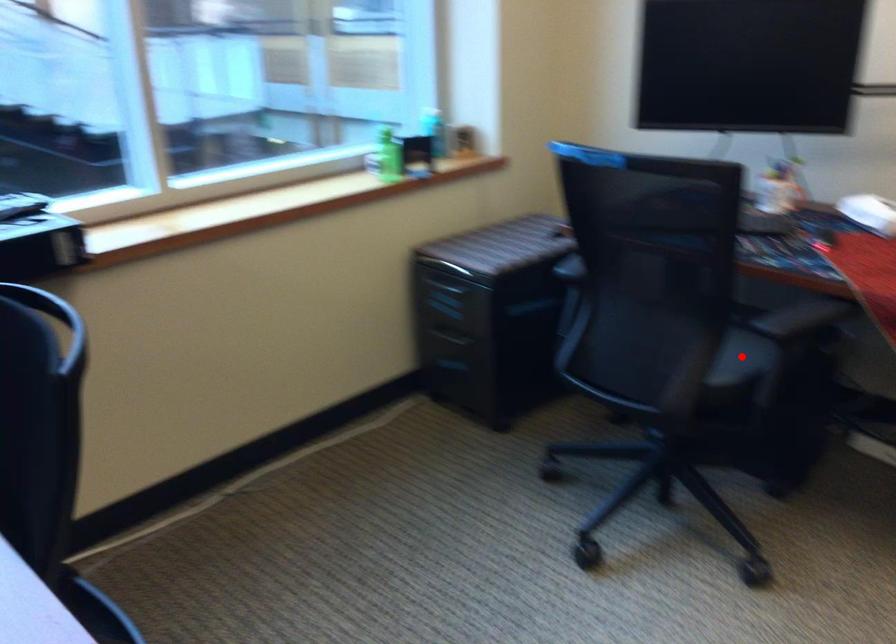
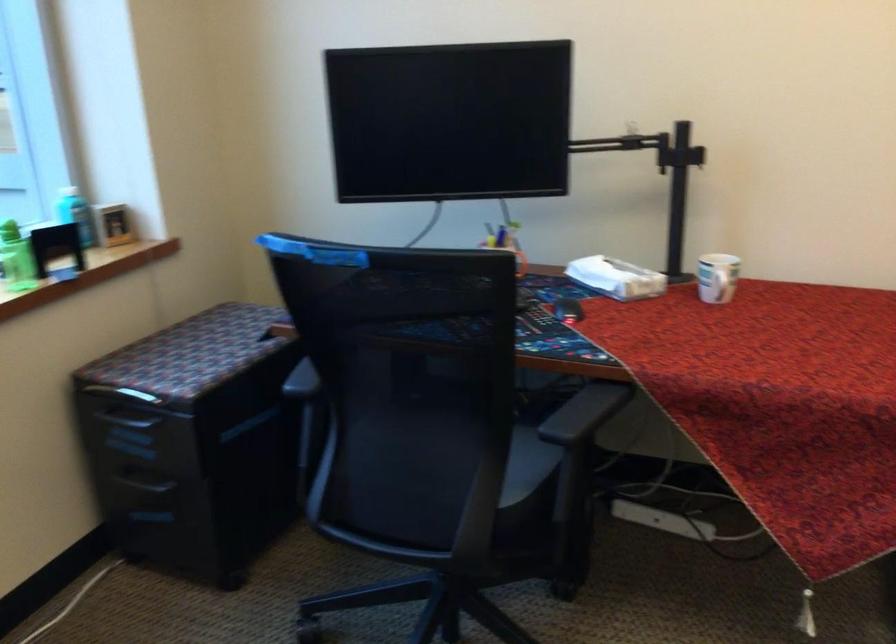
Question: I am providing you with two images of the same scene from different viewpoints. In image1, a red point is highlighted. Considering the same 3D point in image2, which of the following is correct?

Choices:
 (A) It is closer
 (B) It is farther

Answer: (A)